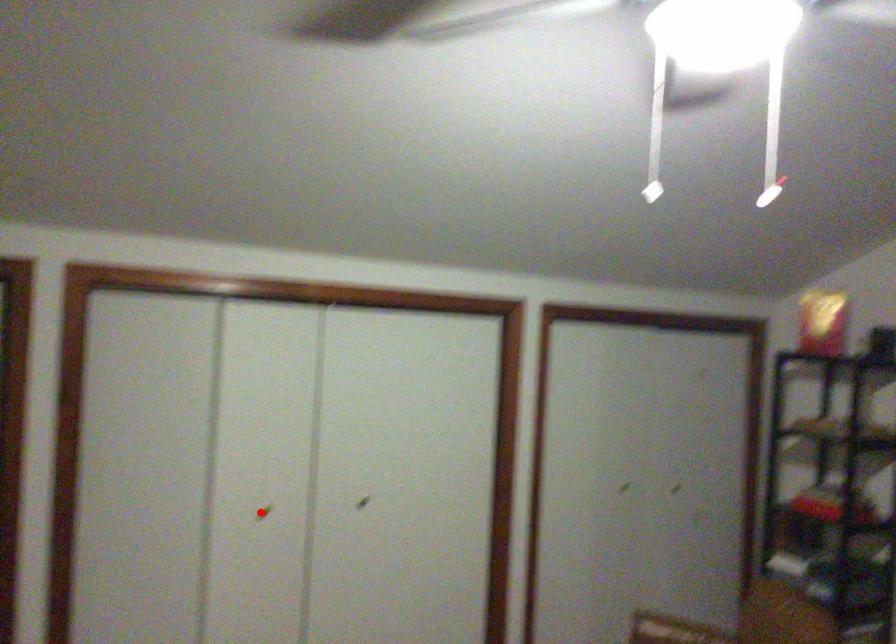
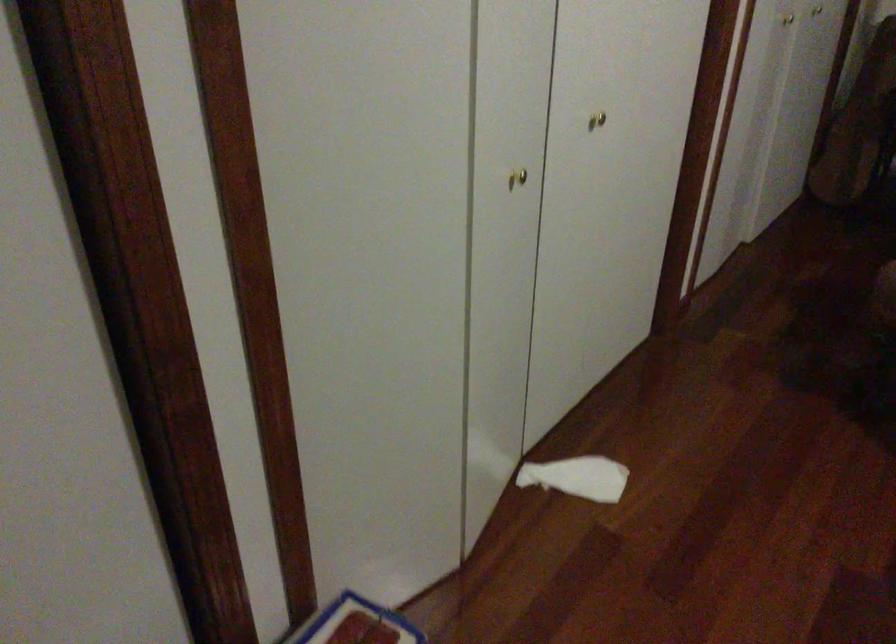
Where in the second image is the point corresponding to the highlighted location from the first image?

(517, 178)